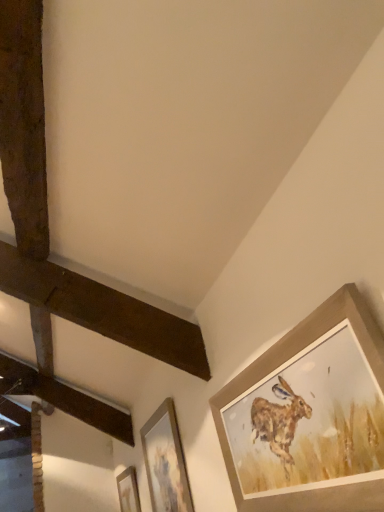
Question: Choose the correct answer: Is wooden picture frame at center, the 2th picture frame in the bottom-to-top sequence, inside wooden picture frame at lower center, positioned as the third picture frame in top-to-bottom order, or outside it?

Choices:
 (A) outside
 (B) inside

Answer: (A)

Question: Is wooden picture frame at center, the 2th picture frame from the right, in front of or behind wooden picture frame at lower center, which is the first picture frame in left-to-right order, in the image?

Choices:
 (A) behind
 (B) front

Answer: (B)

Question: Which object is the closest to the wooden picture frame at center, the second picture frame when ordered from top to bottom?

Choices:
 (A) wooden picture frame at lower center, placed as the first picture frame when sorted from bottom to top
 (B) wooden picture frame at upper right, placed as the 1th picture frame when sorted from top to bottom

Answer: (A)

Question: Estimate the real-world distances between objects in this image. Which object is farther from the wooden picture frame at upper right, acting as the 1th picture frame starting from the front?

Choices:
 (A) wooden picture frame at center, the 2th picture frame in the bottom-to-top sequence
 (B) wooden picture frame at lower center, the 3th picture frame viewed from the right

Answer: (B)